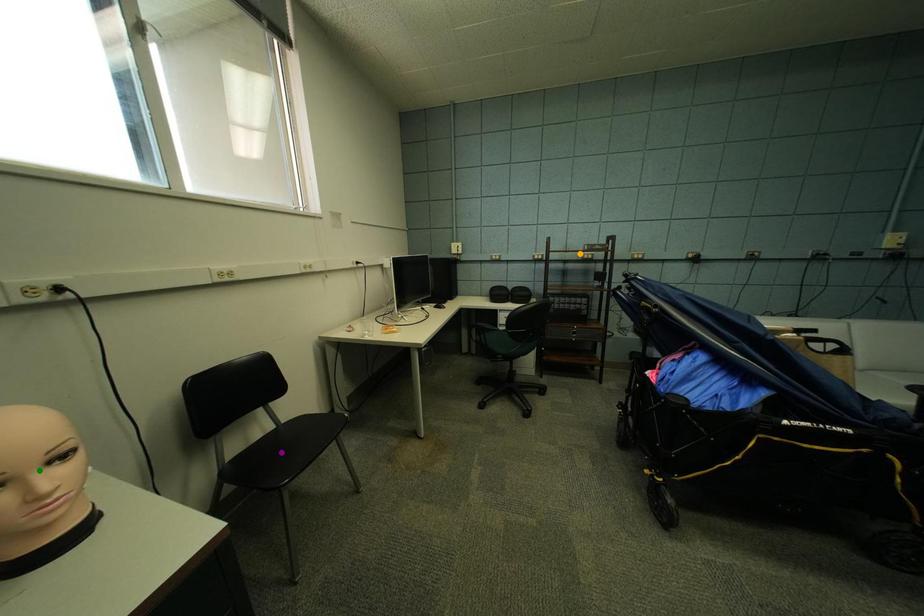
Looking at this image, order these from nearest to farthest:
- green point
- orange point
- purple point

green point → purple point → orange point